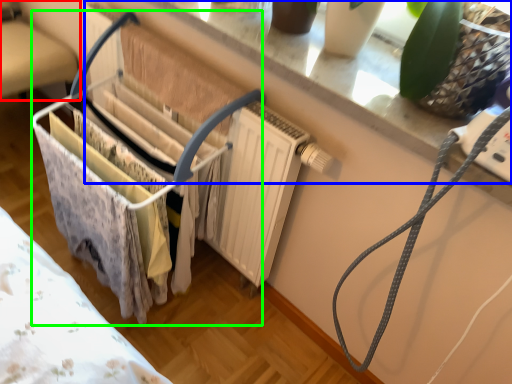
Question: Considering the real-world distances, which object is closest to furniture (highlighted by a red box)? window sill (highlighted by a blue box) or baby carriage (highlighted by a green box).

Choices:
 (A) window sill
 (B) baby carriage

Answer: (B)